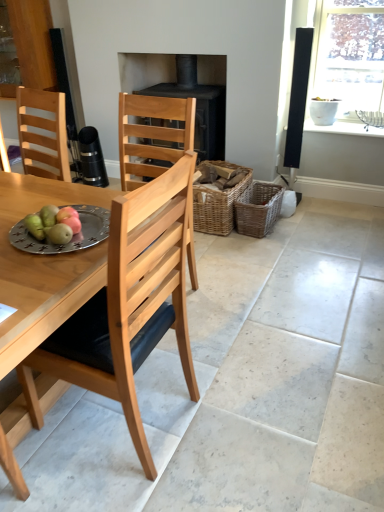
Where is `vacant space in front of silver metallic plate at table left`? The image size is (384, 512). vacant space in front of silver metallic plate at table left is located at coordinates (44, 265).